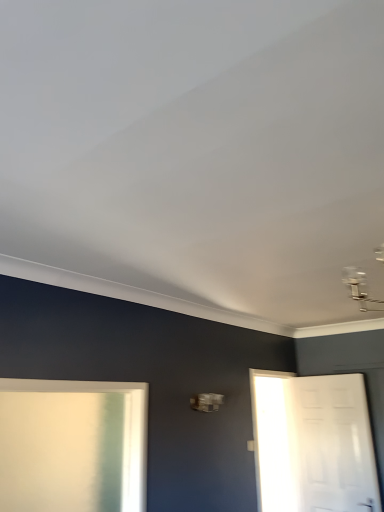
Image resolution: width=384 pixels, height=512 pixels. What do you see at coordinates (313, 443) in the screenshot?
I see `white glossy door at lower right` at bounding box center [313, 443].

Locate an element on the screen. white glossy door at lower right is located at coordinates (313, 443).

Identify the location of white glossy door at lower right. The image size is (384, 512). [x=313, y=443].